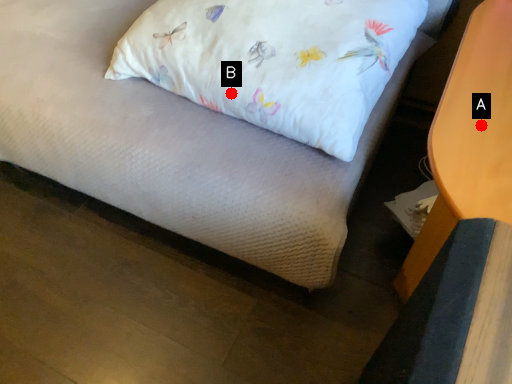
Question: Two points are circled on the image, labeled by A and B beside each circle. Which point is closer to the camera?

Choices:
 (A) A is closer
 (B) B is closer

Answer: (A)